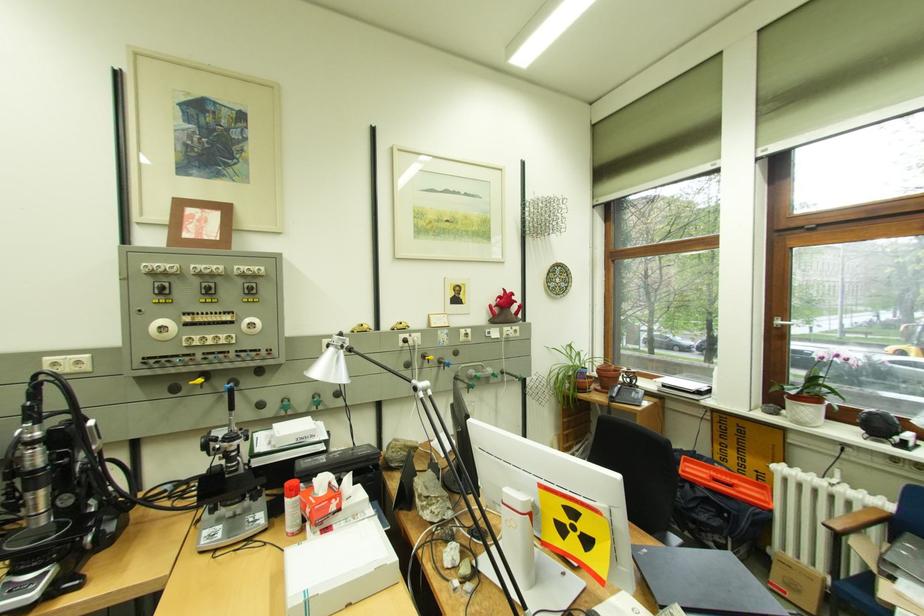
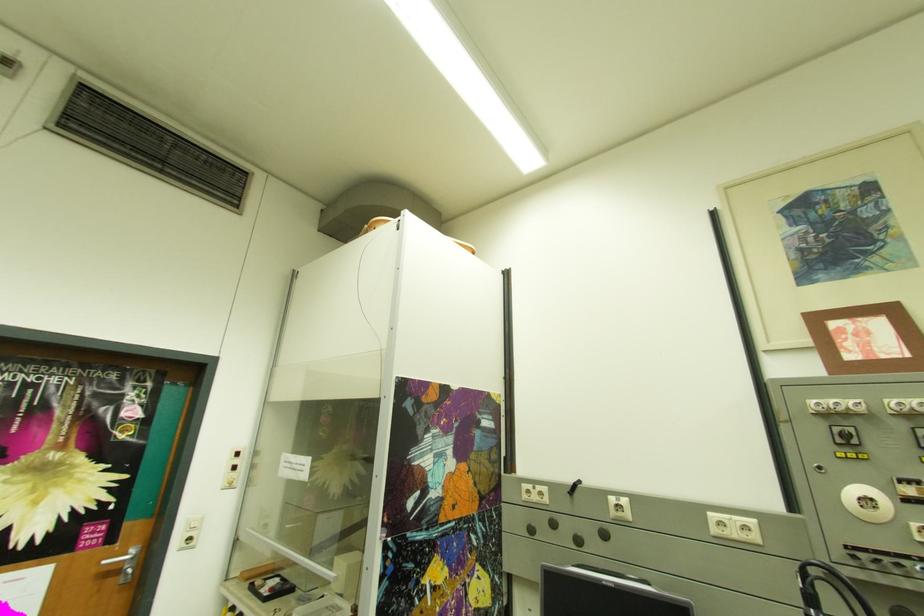
Based on the continuous images, in which direction is the camera rotating?

The camera's rotation is toward left-up.